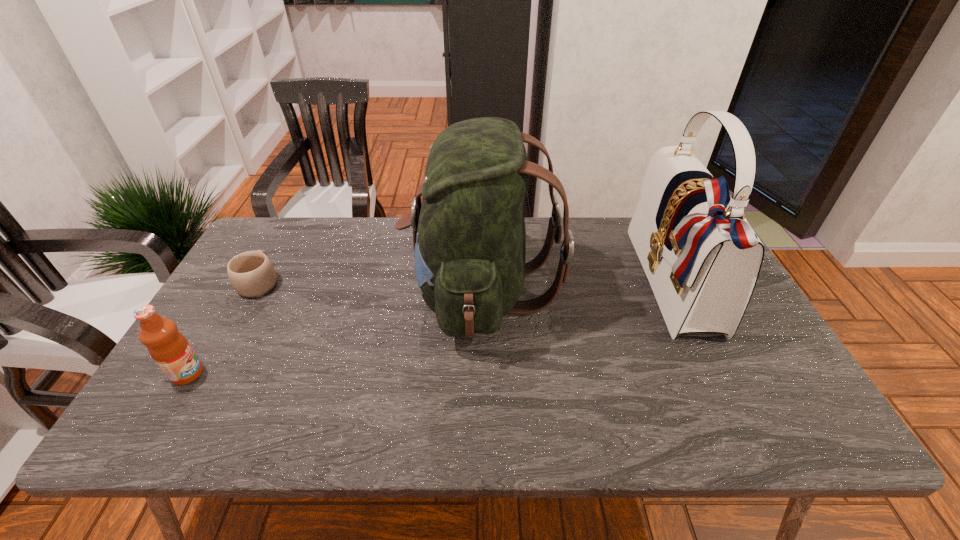
Locate an element on the screen. This screenshot has width=960, height=540. free space at the far edge of the desktop is located at coordinates (395, 240).

Locate an element on the screen. free space at the near edge of the desktop is located at coordinates (627, 414).

Identify the location of vacant space at the left edge. (215, 365).

You are a GUI agent. You are given a task and a screenshot of the screen. Output one action in this format:
    pyautogui.click(x=<x>, y=<y>)
    Task: Click on the vacant space at the far left corner
    
    Given the screenshot: What is the action you would take?
    pyautogui.click(x=300, y=232)

Locate an element on the screen. This screenshot has height=540, width=960. free spot between the satchel and the fruit juice is located at coordinates (431, 329).

Where is `free space between the mug and the fruit juice`? This screenshot has height=540, width=960. free space between the mug and the fruit juice is located at coordinates (224, 328).

Where is `empty space between the mug and the fruit juice`? This screenshot has width=960, height=540. empty space between the mug and the fruit juice is located at coordinates (224, 328).

The width and height of the screenshot is (960, 540). In order to click on free spot between the fruit juice and the satchel in this screenshot , I will do `click(431, 329)`.

You are a GUI agent. You are given a task and a screenshot of the screen. Output one action in this format:
    pyautogui.click(x=<x>, y=<y>)
    Task: Click on the free space between the shortest object and the backpack
    
    Given the screenshot: What is the action you would take?
    pyautogui.click(x=371, y=287)

Image resolution: width=960 pixels, height=540 pixels. I want to click on free space between the rightmost object and the backpack, so click(578, 288).